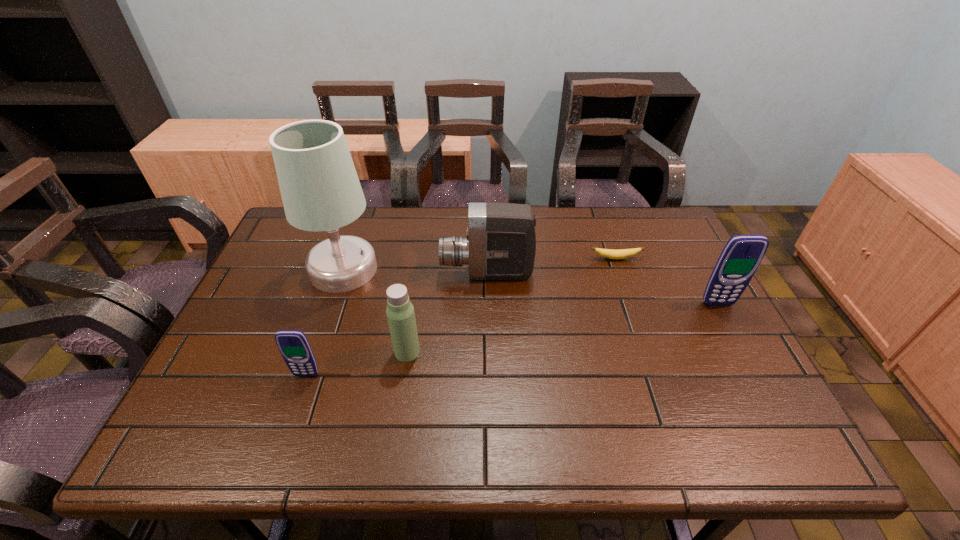
I want to click on free space located on the front-facing side of the shorter cellular telephone, so [x=300, y=396].

Find the location of `vacant space located on the front-facing side of the taller cellular telephone`. vacant space located on the front-facing side of the taller cellular telephone is located at coordinates (735, 336).

At what (x,y) coordinates should I click in order to perform the action: click on free space located 0.270m on the left of the banana. Please return your answer as a coordinate pair (x, y). The image size is (960, 540). Looking at the image, I should click on (499, 259).

This screenshot has width=960, height=540. What are the coordinates of `vacant space located at the front of the fourth object from left to right, highlighting the lens` in the screenshot? It's located at (366, 274).

Where is `vacant space located at the front of the fourth object from left to right, highlighting the lens`? The height and width of the screenshot is (540, 960). vacant space located at the front of the fourth object from left to right, highlighting the lens is located at coordinates (355, 274).

This screenshot has height=540, width=960. I want to click on vacant space located 0.180m at the front of the fourth object from left to right, highlighting the lens, so click(379, 274).

Locate an element on the screen. The width and height of the screenshot is (960, 540). free space located 0.200m on the base of the lampshade is located at coordinates (315, 353).

Locate an element on the screen. The height and width of the screenshot is (540, 960). free region located on the left of the fourth object from right to left is located at coordinates (237, 352).

Where is `object situated at the far edge`? This screenshot has width=960, height=540. object situated at the far edge is located at coordinates (320, 189).

Locate an element on the screen. This screenshot has width=960, height=540. object situated at the near edge is located at coordinates (294, 347).